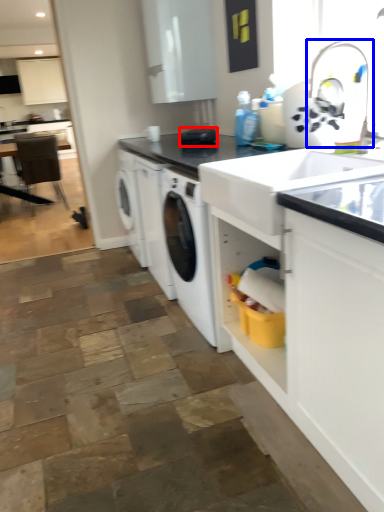
Question: Which point is further to the camera, appliance (highlighted by a red box) or faucet (highlighted by a blue box)?

Choices:
 (A) appliance
 (B) faucet

Answer: (A)